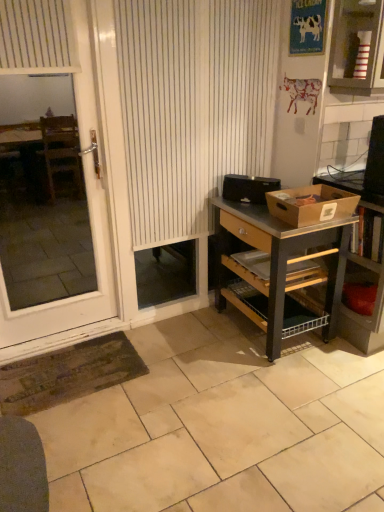
Locate an element on the screen. vacant space in front of wooden desk at right is located at coordinates (284, 387).